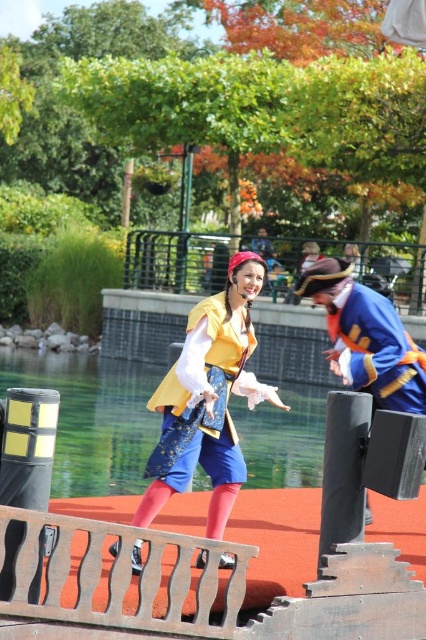
You are a photographer trying to capture the scene with the transparent blue water at center and the blue satin pirate hat at right. Which object should you focus on first if you want to include both in your shot without moving the camera?

You should focus on the transparent blue water at center first because it is positioned to the left of the blue satin pirate hat at right, so keeping it centered will allow both objects to be in frame.

You are a photographer trying to capture a clear shot of both the transparent blue water at center and the blue satin pirate hat at right. Since you can only focus on one object at a time, which object should you focus on to ensure the other remains in the background?

You should focus on the transparent blue water at center because it is closer to the viewer, and the blue satin pirate hat at right will naturally be in the background when focused on the closer object.